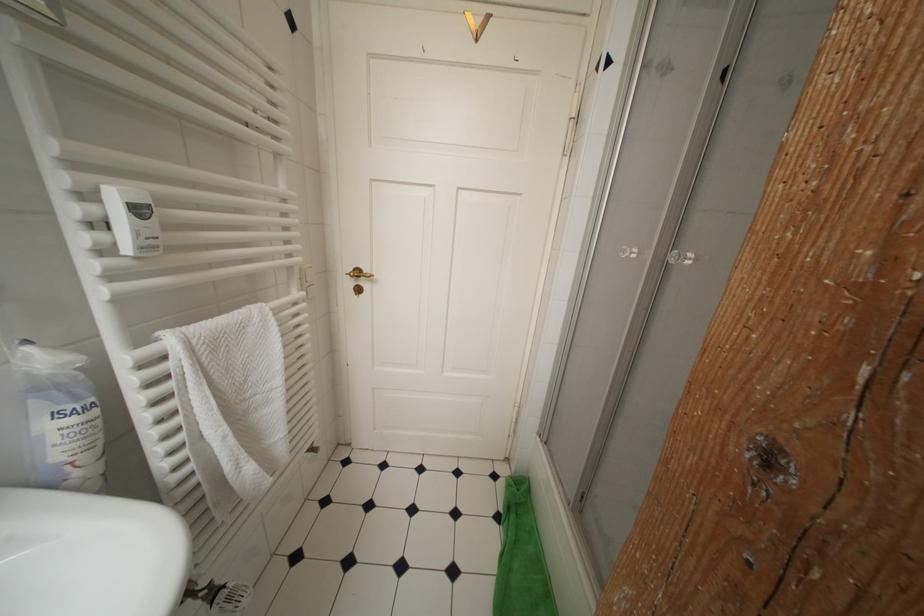
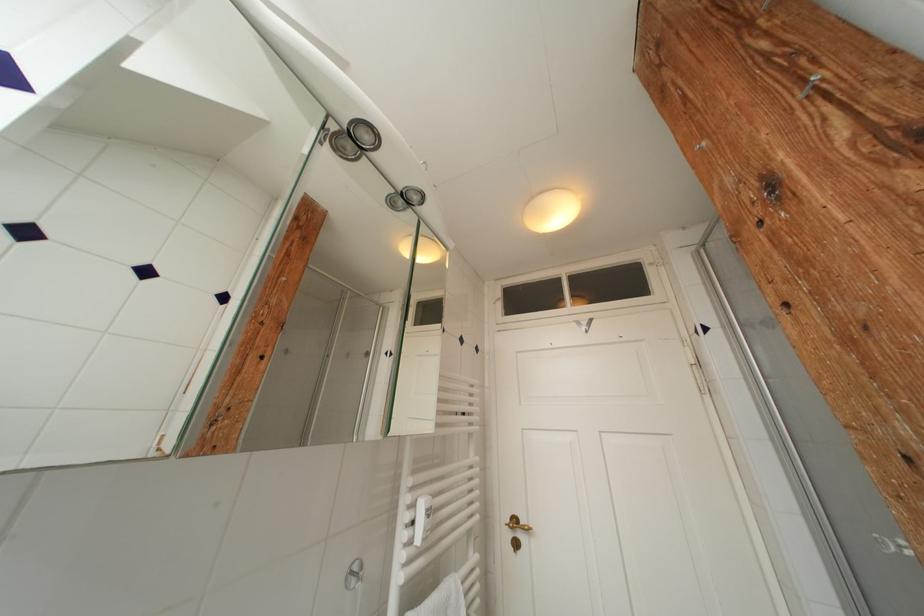
The point at (282, 142) is marked in the first image. Where is the corresponding point in the second image?

(478, 427)